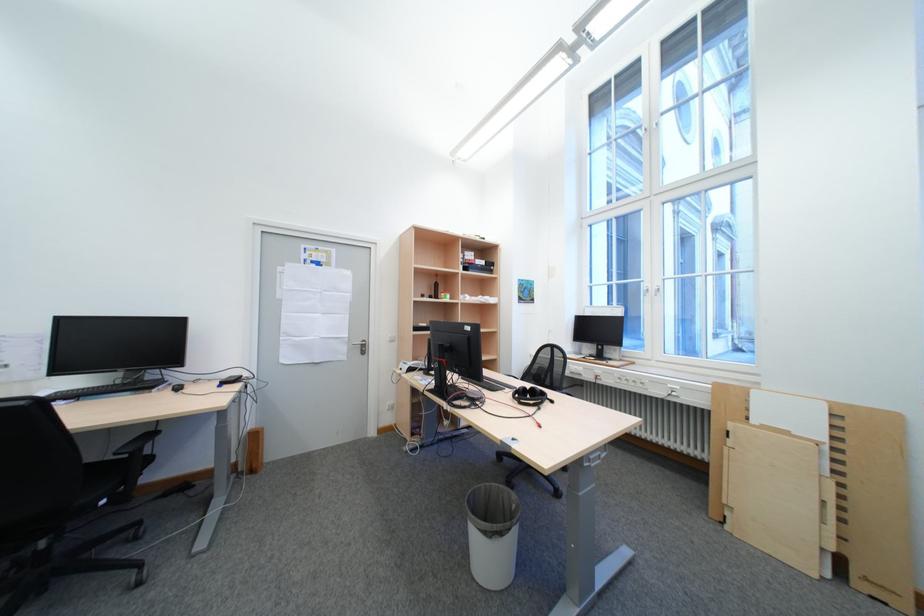
Locate an element on the screen. The height and width of the screenshot is (616, 924). radiator thermostat knob is located at coordinates (647, 385).